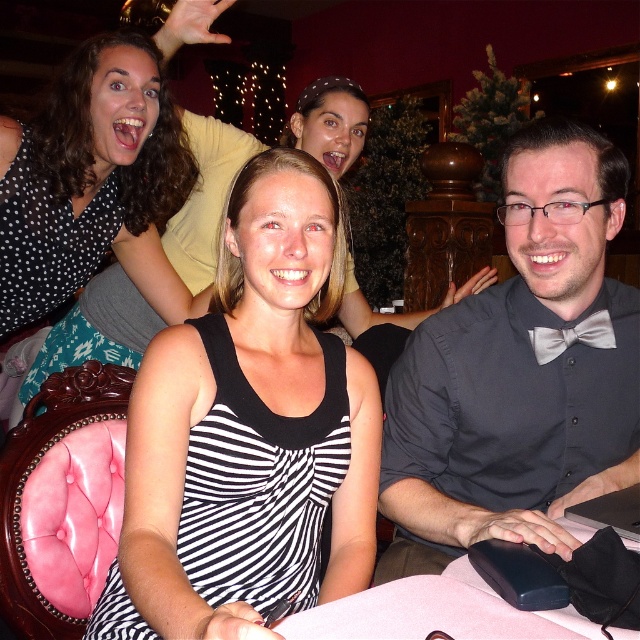
Which of these two, black striped dress at center or silvery satin bow tie at right, stands shorter?

Standing shorter between the two is silvery satin bow tie at right.

Who is positioned more to the left, black striped dress at center or silvery satin bow tie at right?

black striped dress at center

Locate an element on the screen. This screenshot has height=640, width=640. black striped dress at center is located at coordinates (250, 429).

Where is `black striped dress at center`? black striped dress at center is located at coordinates (250, 429).

Can you confirm if matte gray bow tie at center is bigger than silvery satin bow tie at right?

Yes.

Does point (445, 536) lie in front of point (534, 353)?

Yes.

Locate an element on the screen. This screenshot has width=640, height=640. matte gray bow tie at center is located at coordinates (518, 372).

Does black striped dress at center lie in front of polka dot blouse at upper left?

Yes.

Can you confirm if black striped dress at center is taller than polka dot blouse at upper left?

Yes, black striped dress at center is taller than polka dot blouse at upper left.

Does point (312, 438) come farther from viewer compared to point (129, 74)?

No.

You are a GUI agent. You are given a task and a screenshot of the screen. Output one action in this format:
    pyautogui.click(x=<x>, y=<y>)
    Task: Click on the black striped dress at center
    This screenshot has height=640, width=640.
    Given the screenshot: What is the action you would take?
    pyautogui.click(x=250, y=429)